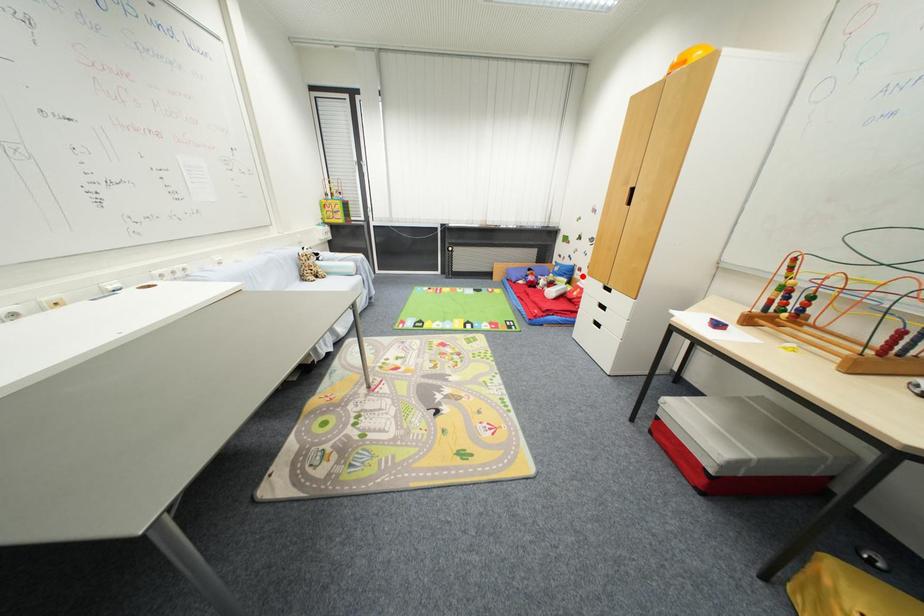
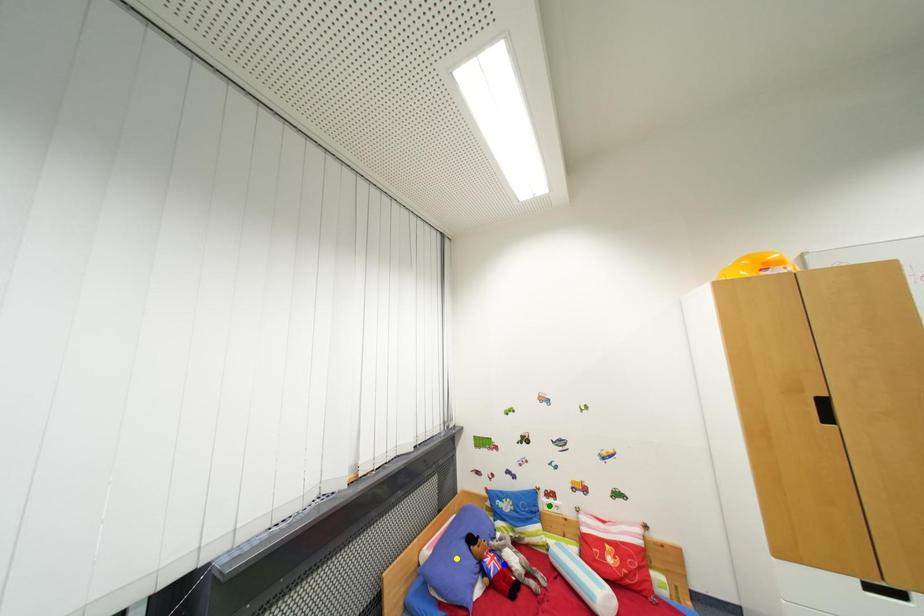
Question: I am providing you with two images of the same scene from different viewpoints. A red point is marked on the first image. You are given multiple points on the second image. Which spot in image 2 lines up with the point in image 1?

Choices:
 (A) blue point
 (B) yellow point
 (C) green point

Answer: (C)